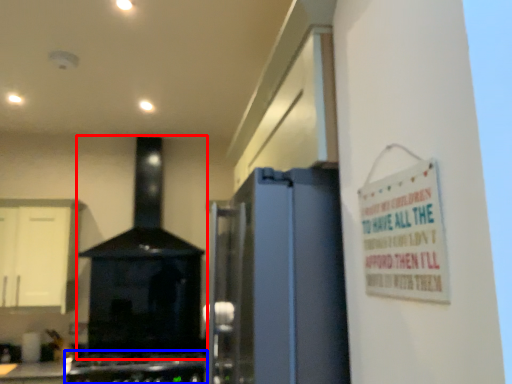
Question: Among these objects, which one is nearest to the camera, home appliance (highlighted by a red box) or gas stove (highlighted by a blue box)?

Choices:
 (A) home appliance
 (B) gas stove

Answer: (B)